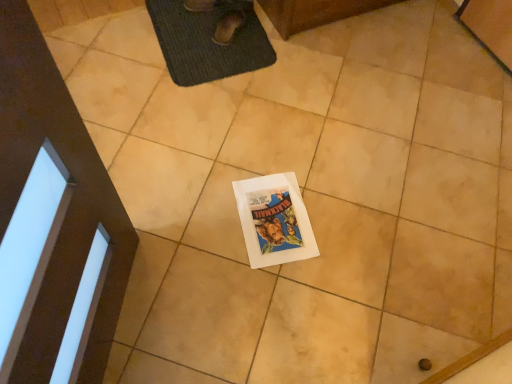
Where is `free spot in front of white paper comic book at center`? The image size is (512, 384). free spot in front of white paper comic book at center is located at coordinates (265, 296).